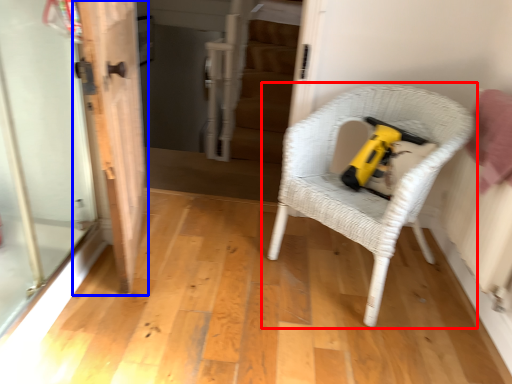
Question: Which object appears closest to the camera in this image, chair (highlighted by a red box) or door (highlighted by a blue box)?

Choices:
 (A) chair
 (B) door

Answer: (B)